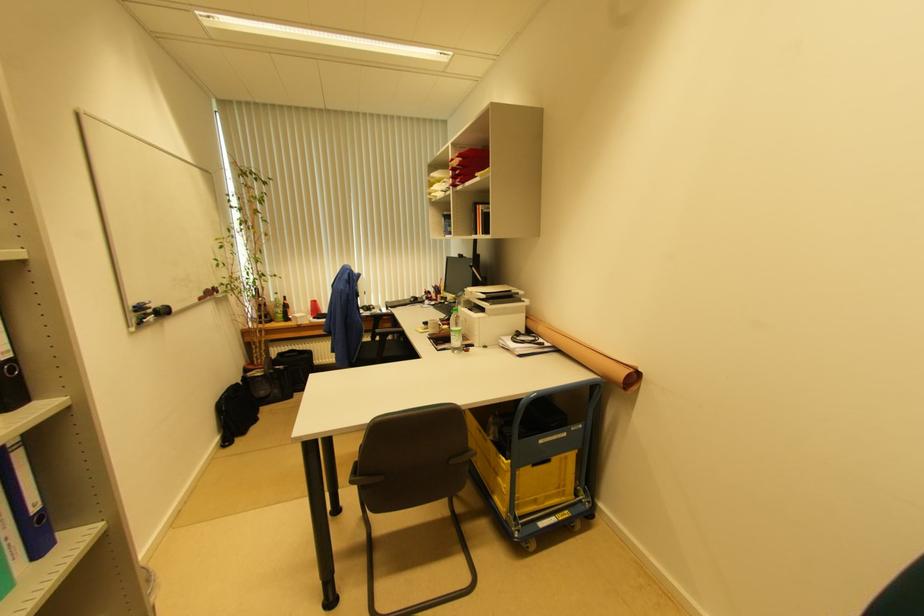
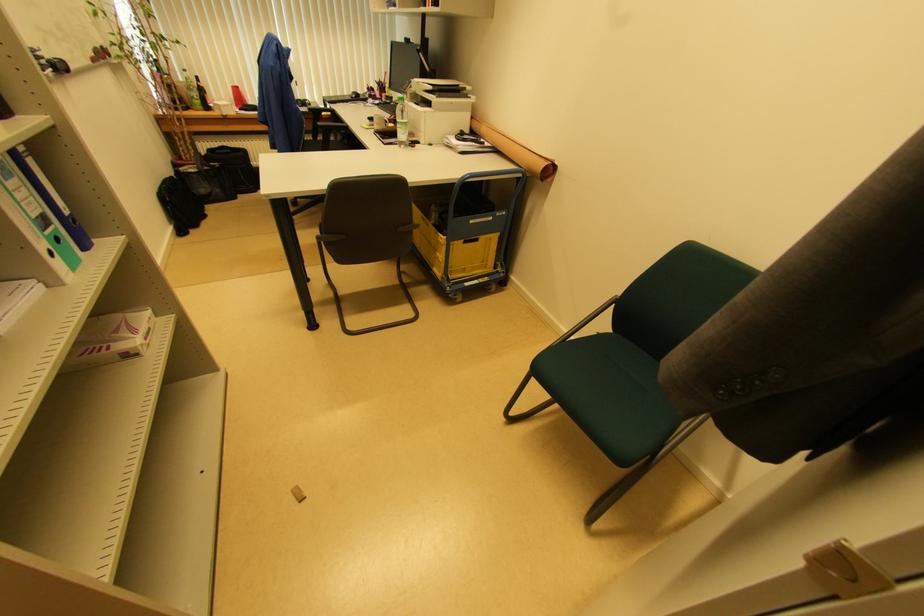
Locate, in the second image, the point that corresponds to (453,339) in the first image.

(398, 132)